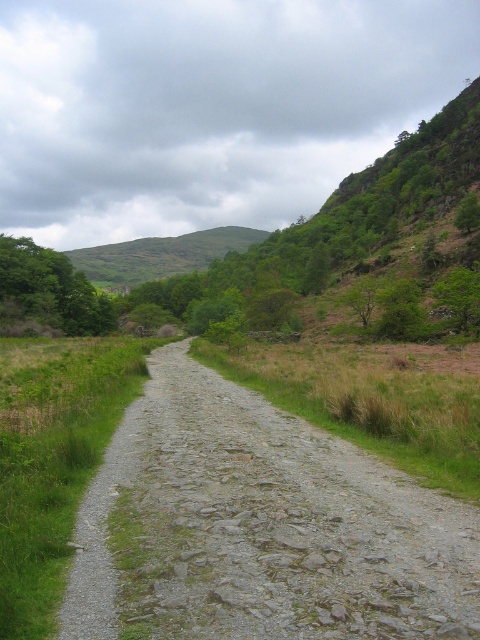
Question: Does gray gravel trail at center have a lesser width compared to green grassy hillside at upper center?

Choices:
 (A) no
 (B) yes

Answer: (B)

Question: Which point appears closest to the camera in this image?

Choices:
 (A) (108, 515)
 (B) (132, 250)

Answer: (A)

Question: Which object appears closest to the camera in this image?

Choices:
 (A) green grassy hillside at upper center
 (B) gray gravel trail at center

Answer: (B)

Question: Can you confirm if gray gravel trail at center is smaller than green grassy hillside at upper center?

Choices:
 (A) no
 (B) yes

Answer: (B)

Question: Is gray gravel trail at center below green grassy hillside at upper center?

Choices:
 (A) no
 (B) yes

Answer: (B)